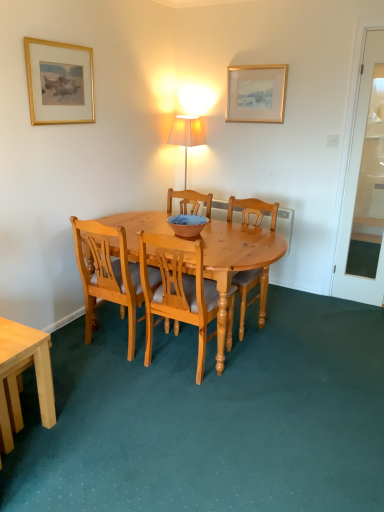
Where is `vacant space in front of light brown wooden chair at center, arranged as the third chair when viewed from the left`? The image size is (384, 512). vacant space in front of light brown wooden chair at center, arranged as the third chair when viewed from the left is located at coordinates (272, 354).